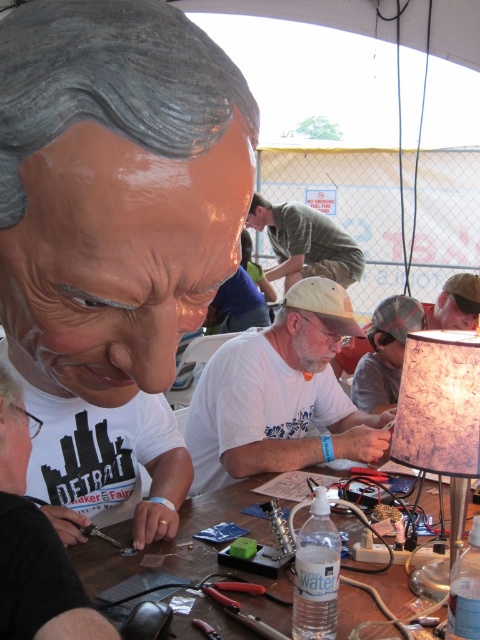
Between matte plastic mask at center and marbled paper lampshade at right, which one has less height?

With less height is marbled paper lampshade at right.

Is point (87, 396) positioned before point (411, 400)?

That is True.

Who is more forward, [88,173] or [447,451]?

Positioned in front is point [88,173].

What are the coordinates of `matte plastic mask at center` in the screenshot? It's located at (113, 240).

Can you confirm if white fabric shirt at center is shorter than marbled paper lampshade at right?

No, white fabric shirt at center is not shorter than marbled paper lampshade at right.

Is white fabric shirt at center further to the viewer compared to marbled paper lampshade at right?

Yes, it is.

Who is more distant from viewer, (334, 410) or (428, 376)?

Positioned behind is point (334, 410).

Locate an element on the screen. The height and width of the screenshot is (640, 480). white fabric shirt at center is located at coordinates click(x=279, y=396).

Is metallic brown table at center shorter than white matte t-shirt at center?

Indeed, metallic brown table at center has a lesser height compared to white matte t-shirt at center.

From the picture: Who is positioned more to the right, metallic brown table at center or white matte t-shirt at center?

metallic brown table at center is more to the right.

Does point (189, 637) come in front of point (48, 563)?

No, it is not.

You are a GUI agent. You are given a task and a screenshot of the screen. Output one action in this format:
    pyautogui.click(x=<x>, y=<y>)
    Task: Click on the metallic brown table at center
    Image resolution: width=480 pixels, height=640 pixels.
    Given the screenshot: What is the action you would take?
    point(176,540)